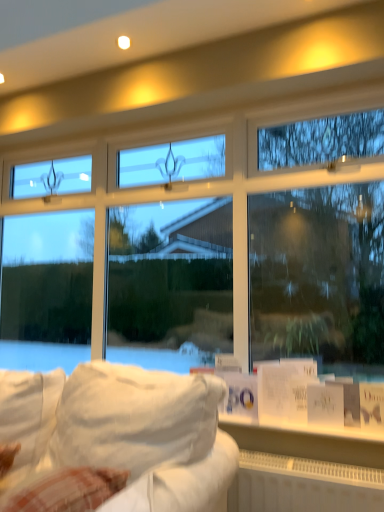
Question: Can you confirm if white plastic radiator at lower center is positioned to the left of white fabric couch at lower left?

Choices:
 (A) no
 (B) yes

Answer: (A)

Question: Is white plastic radiator at lower center taller than white fabric couch at lower left?

Choices:
 (A) yes
 (B) no

Answer: (B)

Question: Is white plastic radiator at lower center facing away from white fabric couch at lower left?

Choices:
 (A) no
 (B) yes

Answer: (A)

Question: From a real-world perspective, is white plastic radiator at lower center on top of white fabric couch at lower left?

Choices:
 (A) yes
 (B) no

Answer: (B)

Question: Considering the relative sizes of white plastic radiator at lower center and white fabric couch at lower left in the image provided, is white plastic radiator at lower center shorter than white fabric couch at lower left?

Choices:
 (A) yes
 (B) no

Answer: (A)

Question: Is white plastic radiator at lower center outside of white fabric couch at lower left?

Choices:
 (A) no
 (B) yes

Answer: (B)

Question: From a real-world perspective, is white fabric couch at lower left below white plastic radiator at lower center?

Choices:
 (A) no
 (B) yes

Answer: (A)

Question: Is white fabric couch at lower left oriented towards white plastic radiator at lower center?

Choices:
 (A) no
 (B) yes

Answer: (A)

Question: From the image's perspective, would you say white fabric couch at lower left is positioned over white plastic radiator at lower center?

Choices:
 (A) yes
 (B) no

Answer: (A)

Question: Can you confirm if white fabric couch at lower left is positioned to the left of white plastic radiator at lower center?

Choices:
 (A) yes
 (B) no

Answer: (A)

Question: Does white fabric couch at lower left come in front of white plastic radiator at lower center?

Choices:
 (A) no
 (B) yes

Answer: (B)

Question: Considering the relative positions of white fabric couch at lower left and white plastic radiator at lower center in the image provided, is white fabric couch at lower left to the right of white plastic radiator at lower center from the viewer's perspective?

Choices:
 (A) no
 (B) yes

Answer: (A)

Question: Relative to white plastic radiator at lower center, is white fabric couch at lower left in front or behind?

Choices:
 (A) front
 (B) behind

Answer: (A)